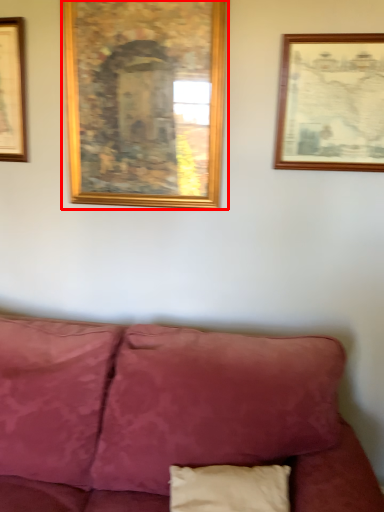
Question: From the image's perspective, considering the relative positions of picture frame (annotated by the red box) and picture frame in the image provided, where is picture frame (annotated by the red box) located with respect to the staircase?

Choices:
 (A) above
 (B) below

Answer: (A)